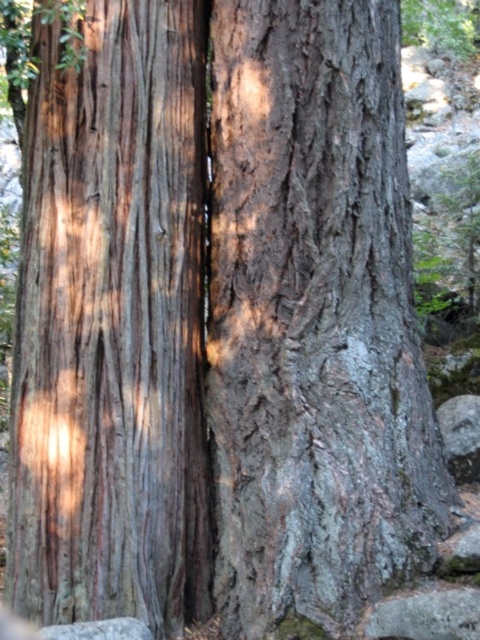
You are a hiker trying to identify landmarks. You see the smooth brown bark at center and the gray rough stone at lower left. Which one is bigger in size?

The smooth brown bark at center is larger in size than the gray rough stone at lower left.

You are a hiker trying to identify landmarks in the forest. You notice the smooth brown bark at center and the gray rough stone at lower left. Which of these two objects has a greater width?

The smooth brown bark at center has a greater width than the gray rough stone at lower left.

You are a researcher studying tree bark textures. You need to locate the smooth brown bark at center in the image. According to the coordinates provided, where exactly is it positioned?

The smooth brown bark at center is positioned at coordinates point (112, 326).